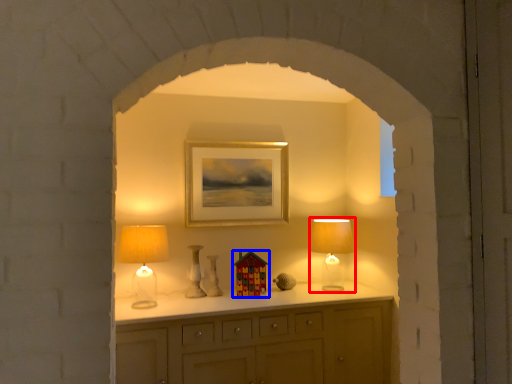
Question: Which object is further to the camera taking this photo, table lamp (highlighted by a red box) or toy (highlighted by a blue box)?

Choices:
 (A) table lamp
 (B) toy

Answer: (B)